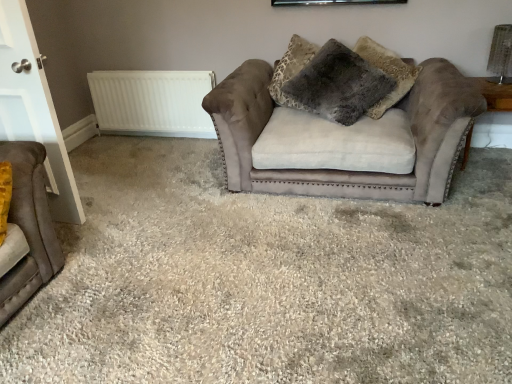
Where is `free region under wooden side table at right (from a real-world perspective)`? This screenshot has width=512, height=384. free region under wooden side table at right (from a real-world perspective) is located at coordinates (482, 168).